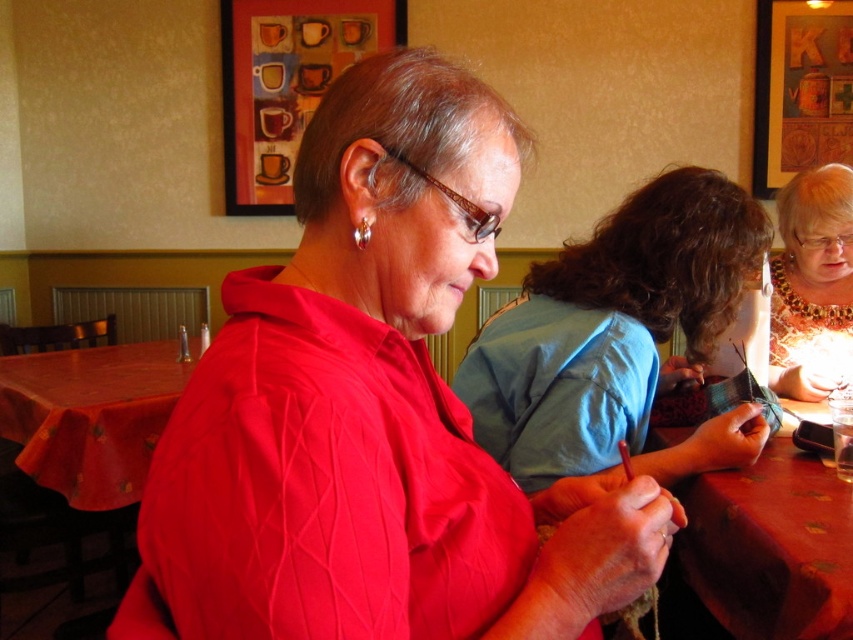
Image resolution: width=853 pixels, height=640 pixels. What do you see at coordinates (373, 412) in the screenshot?
I see `cable-knit sweater at center` at bounding box center [373, 412].

Which of these two, cable-knit sweater at center or gold beaded necklace at upper right, stands shorter?

With less height is gold beaded necklace at upper right.

Is point (566, 570) farther from viewer compared to point (810, 272)?

No.

You are a GUI agent. You are given a task and a screenshot of the screen. Output one action in this format:
    pyautogui.click(x=<x>, y=<y>)
    Task: Click on the cable-knit sweater at center
    This screenshot has width=853, height=640.
    Given the screenshot: What is the action you would take?
    pyautogui.click(x=373, y=412)

Is cable-knit sweater at center bigger than smooth orange tablecloth at lower left?

No.

Is cable-knit sweater at center thinner than smooth orange tablecloth at lower left?

Yes.

The height and width of the screenshot is (640, 853). Describe the element at coordinates (373, 412) in the screenshot. I see `cable-knit sweater at center` at that location.

The width and height of the screenshot is (853, 640). What are the coordinates of `cable-knit sweater at center` in the screenshot? It's located at (373, 412).

Does matte blue shirt at center have a lesser width compared to wooden table at center?

No, matte blue shirt at center is not thinner than wooden table at center.

Can you confirm if matte blue shirt at center is wider than wooden table at center?

Yes.

I want to click on matte blue shirt at center, so click(619, 337).

Find the location of a particular element. The height and width of the screenshot is (640, 853). matte blue shirt at center is located at coordinates (619, 337).